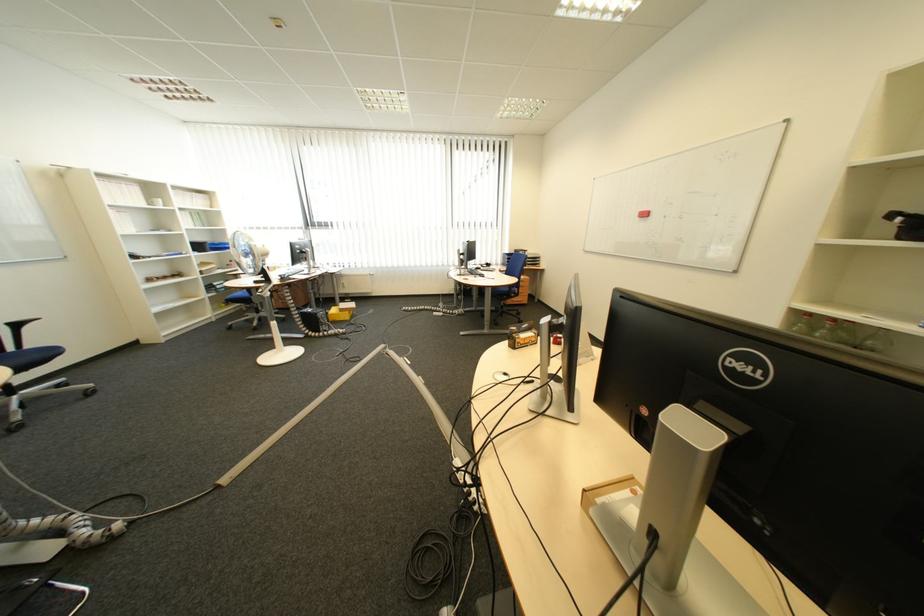
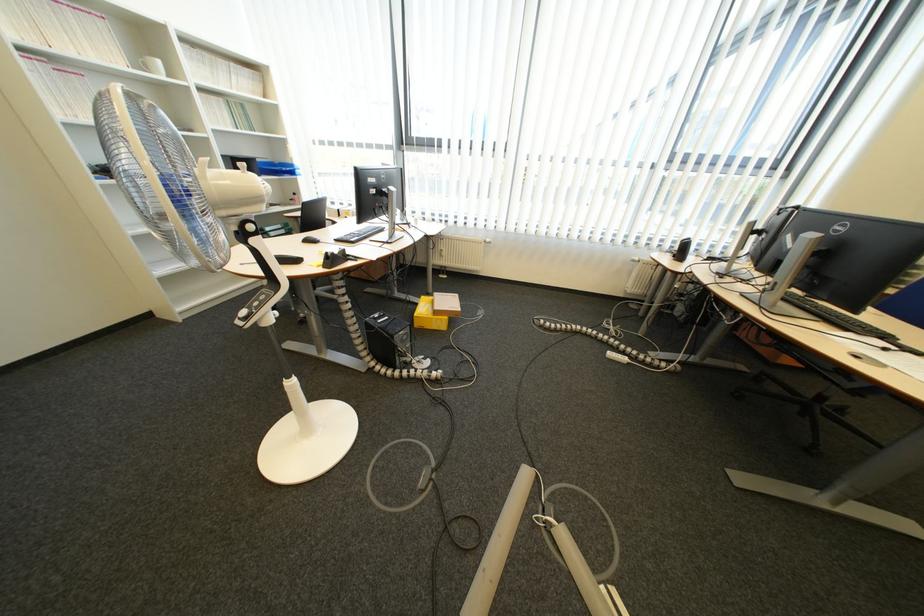
The point at (226, 322) is marked in the first image. Where is the corresponding point in the second image?

(277, 285)